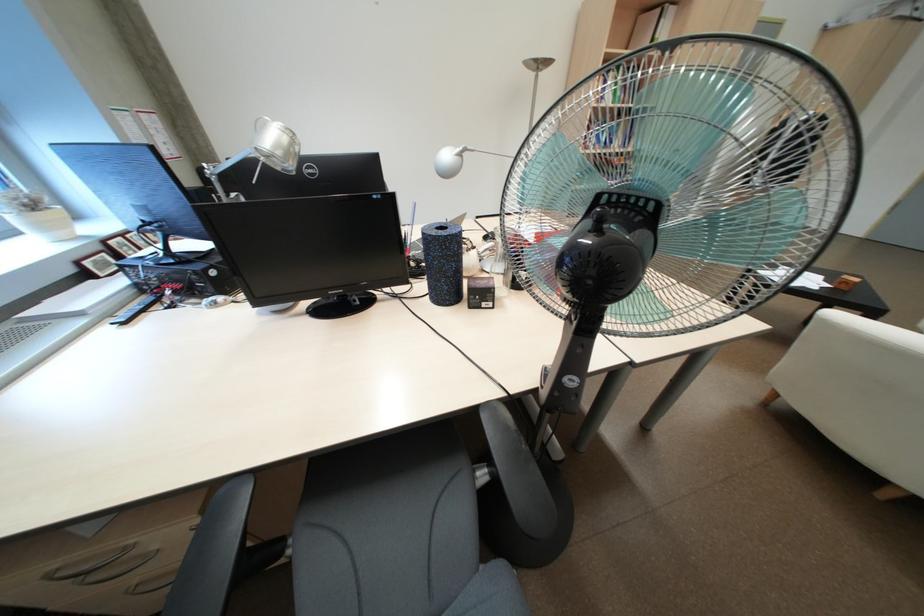
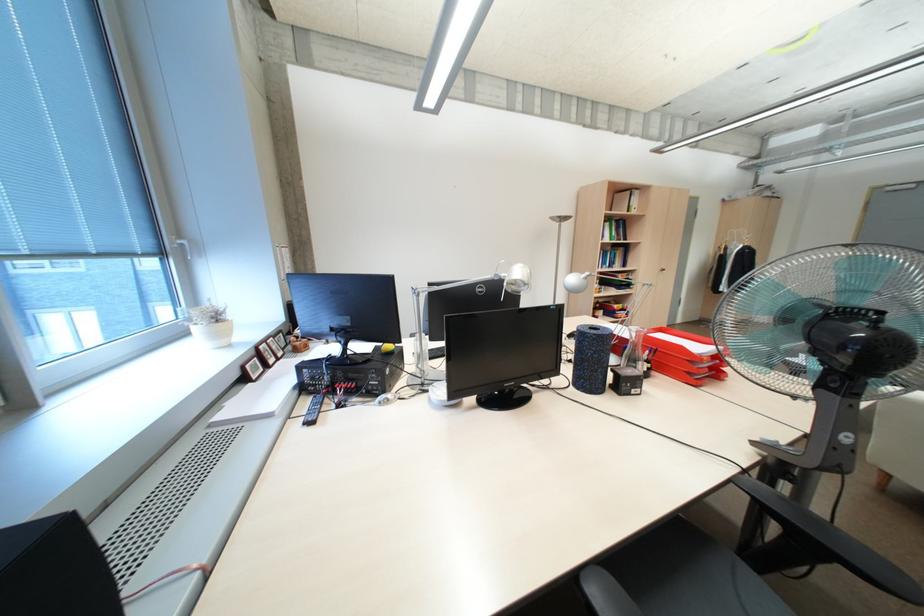
Question: The first image is from the beginning of the video and the second image is from the end. How did the camera likely rotate when shooting the video?

Choices:
 (A) Left
 (B) Right
 (C) Up
 (D) Down

Answer: (C)